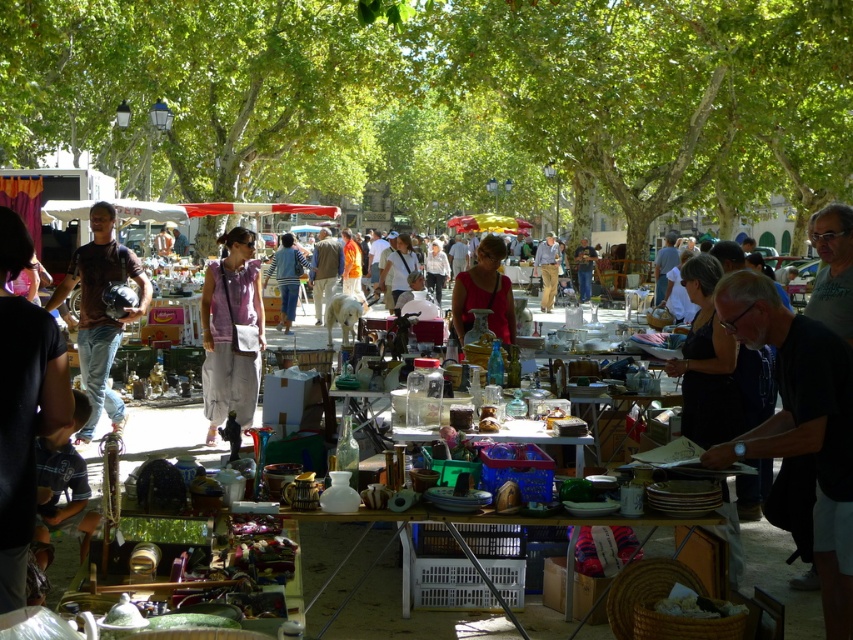
Who is positioned more to the left, matte black helmet at left or matte red blouse at center?

Positioned to the left is matte black helmet at left.

Does matte black helmet at left have a lesser width compared to matte red blouse at center?

No, matte black helmet at left is not thinner than matte red blouse at center.

Which is behind, point (138, 278) or point (494, 276)?

Positioned behind is point (138, 278).

The height and width of the screenshot is (640, 853). Find the location of `matte black helmet at left`. matte black helmet at left is located at coordinates (100, 312).

Which is behind, point (236, 298) or point (457, 285)?

The point (236, 298) is more distant.

Does purple cotton shirt at center lie in front of matte red blouse at center?

No, purple cotton shirt at center is behind matte red blouse at center.

Identify the location of purple cotton shirt at center. click(x=231, y=332).

How far apart are purple cotton shirt at center and matte black helmet at left?

3.46 feet

Is purple cotton shirt at center wider than matte black helmet at left?

No.

Between point (230, 269) and point (88, 376), which one is positioned behind?

The point (230, 269) is more distant.

At what (x,y) coordinates should I click in order to perform the action: click on purple cotton shirt at center. Please return your answer as a coordinate pair (x, y). The height and width of the screenshot is (640, 853). Looking at the image, I should click on (231, 332).